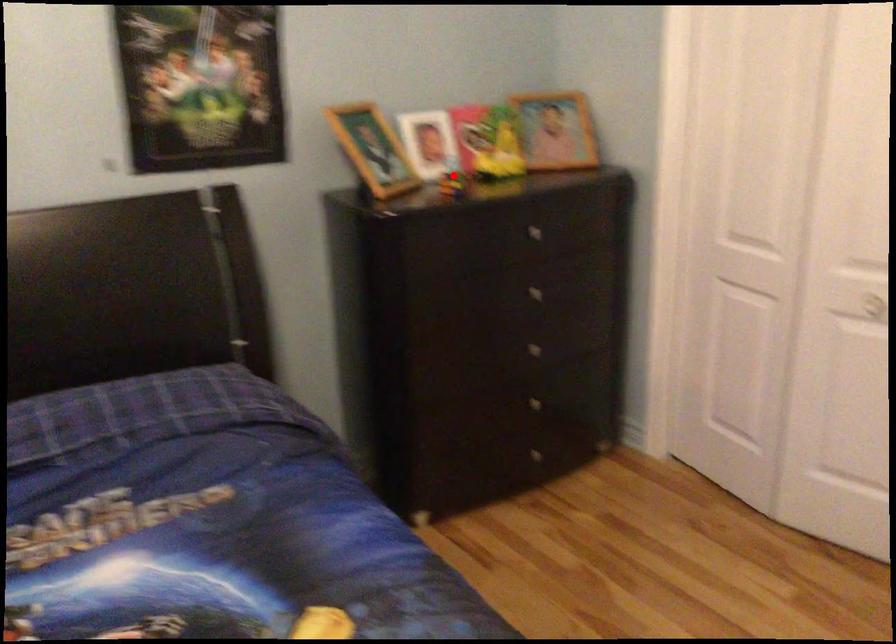
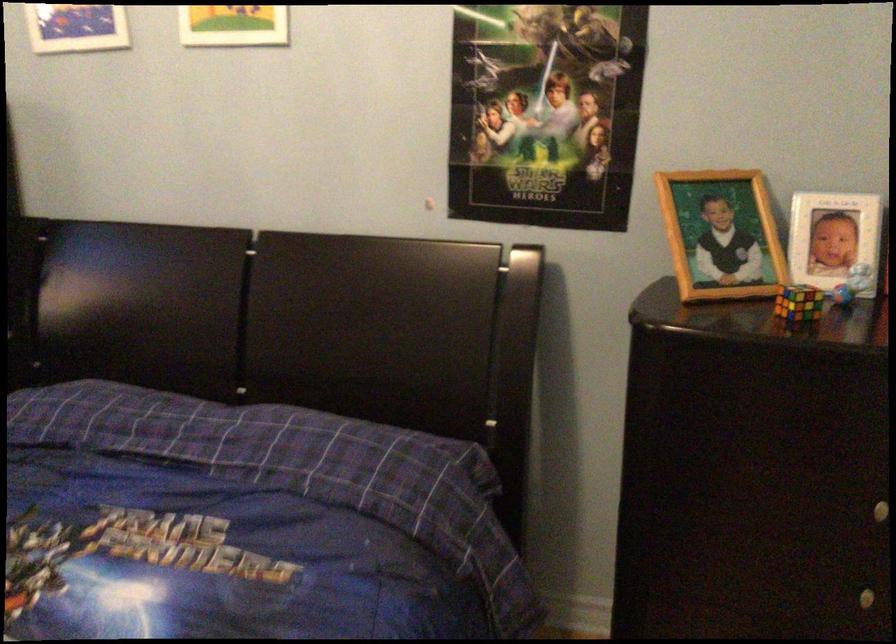
Question: A red point is marked in image1. In image2, is the corresponding 3D point closer to the camera or farther? Reply with the corresponding letter.

Choices:
 (A) The corresponding 3D point is closer.
 (B) The corresponding 3D point is farther.

Answer: (A)